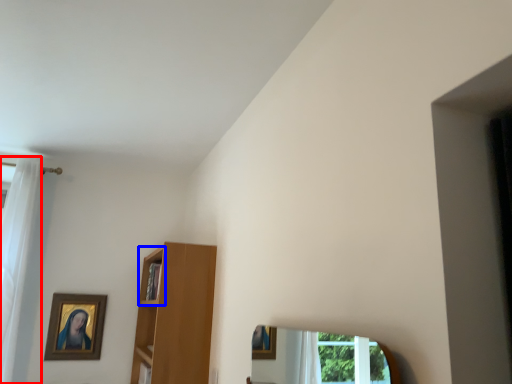
Question: Which object appears farthest to the camera in this image, curtain (highlighted by a red box) or cabinet (highlighted by a blue box)?

Choices:
 (A) curtain
 (B) cabinet

Answer: (A)